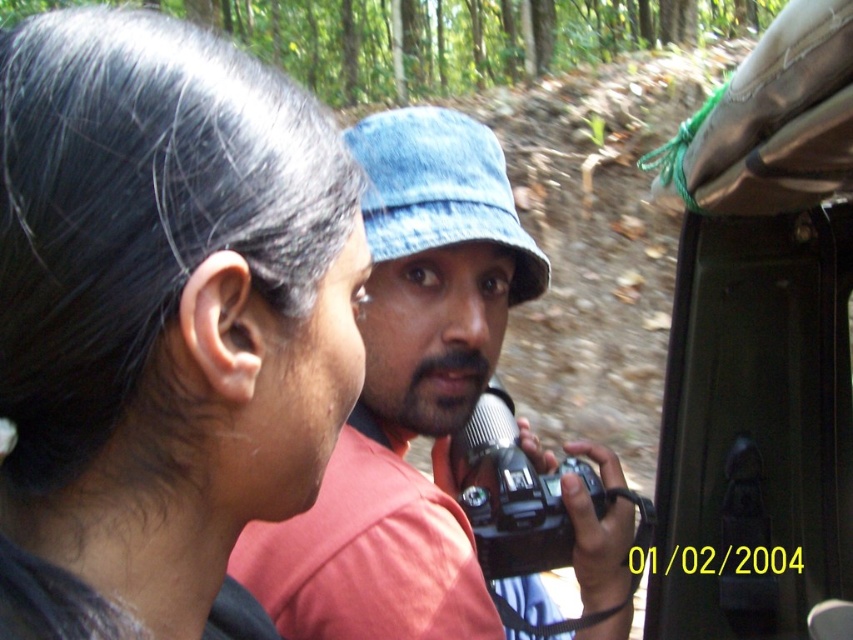
From the picture: You are a photographer trying to capture a clear shot of the man conducting the interview. The denim hat at center and the black plastic camera at center are both in the frame. Which object should you adjust your focus on if you want to ensure the taller object is in focus?

The denim hat at center is much taller than the black plastic camera at center, so you should adjust your focus on the denim hat at center to ensure the taller object is in focus.

You are a photographer trying to capture a wide shot of the scene. The black hair at upper left and the metallic silver vehicle at right are both in the frame. Which object takes up more space in the photo?

The metallic silver vehicle at right takes up more space in the photo because its width is greater than the black hair at upper left.

You are setting up a photo shoot and need to place a small sticker on the object with the larger width between the denim hat at center and the black plastic camera at center. Which object should you choose?

The denim hat at center has a larger width than the black plastic camera at center, so you should place the sticker on the denim hat at center.